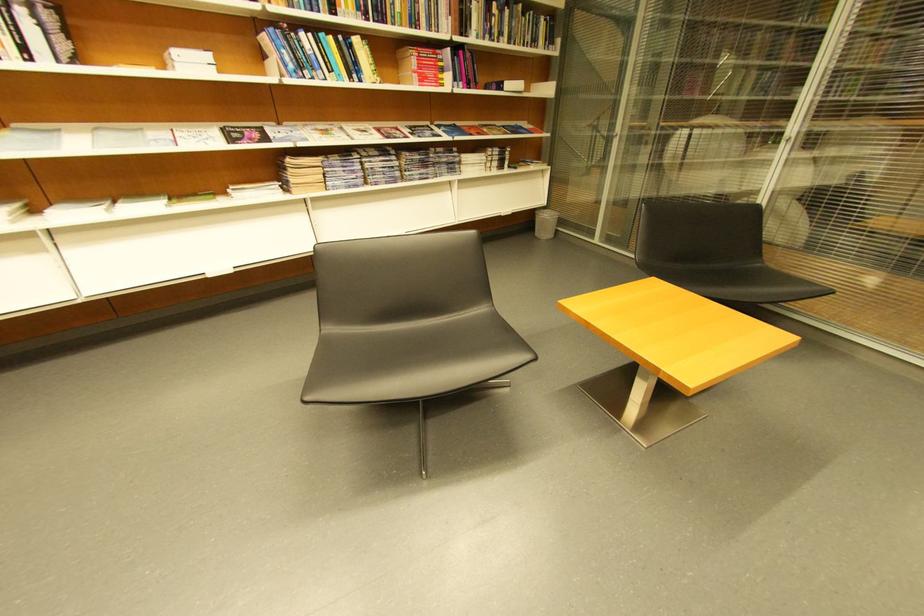
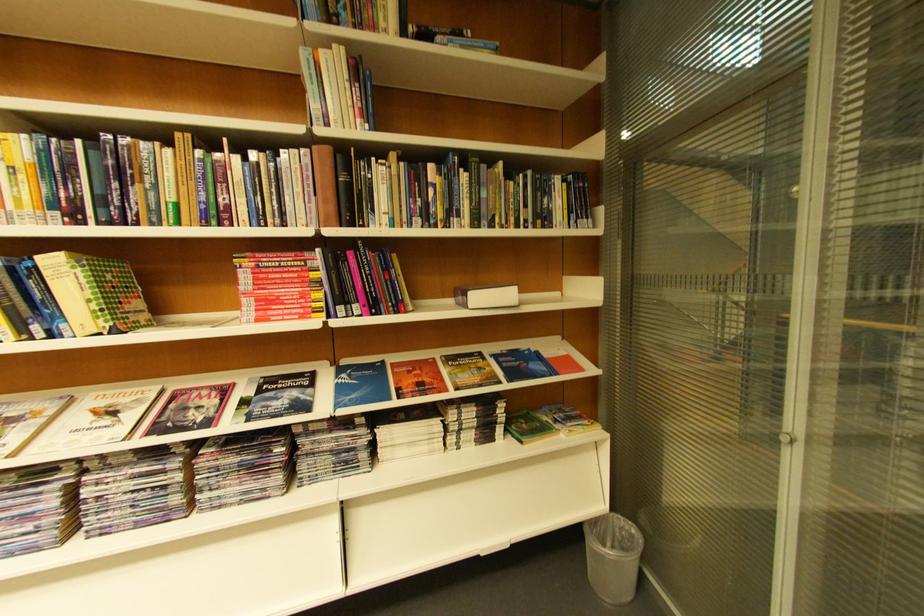
Locate, in the second image, the point that corresponds to (x=400, y=130) in the first image.

(224, 389)